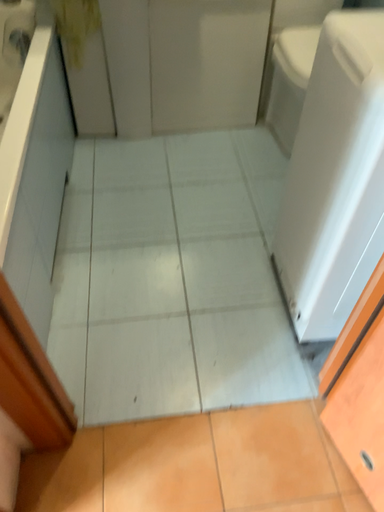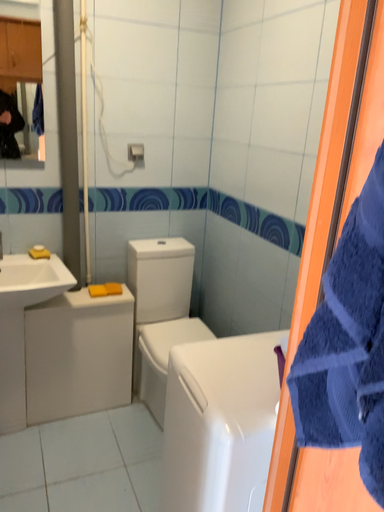
Question: Which way did the camera rotate in the video?

Choices:
 (A) rotated right
 (B) rotated left

Answer: (A)